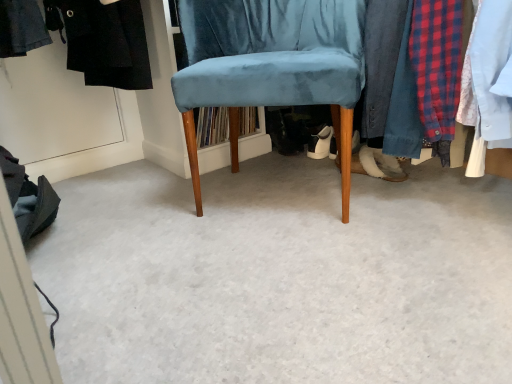
Locate an element on the screen. Image resolution: width=512 pixels, height=384 pixels. blank space to the left of velvet blue chair at center is located at coordinates (136, 205).